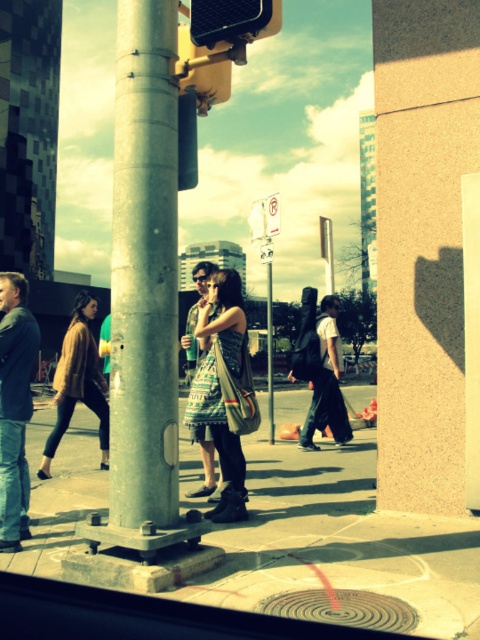
Question: Does denim jacket at left have a larger size compared to matte brown cardigan at lower left?

Choices:
 (A) no
 (B) yes

Answer: (B)

Question: Which object appears farthest from the camera in this image?

Choices:
 (A) metallic rectangular sign at center
 (B) matte brown cardigan at lower left

Answer: (A)

Question: Does dark gray backpack at center have a larger size compared to matte brown cardigan at lower left?

Choices:
 (A) no
 (B) yes

Answer: (B)

Question: Which object is closer to the camera taking this photo?

Choices:
 (A) matte brown cardigan at lower left
 (B) patterned fabric dress at center

Answer: (B)

Question: Where is smooth concrete sidewalk at center located in relation to denim jacket at left in the image?

Choices:
 (A) right
 (B) left

Answer: (A)

Question: Which point is farther from the camera taking this photo?

Choices:
 (A) (269, 243)
 (B) (205, 593)
 (C) (273, 429)
 (D) (118, 362)

Answer: (A)